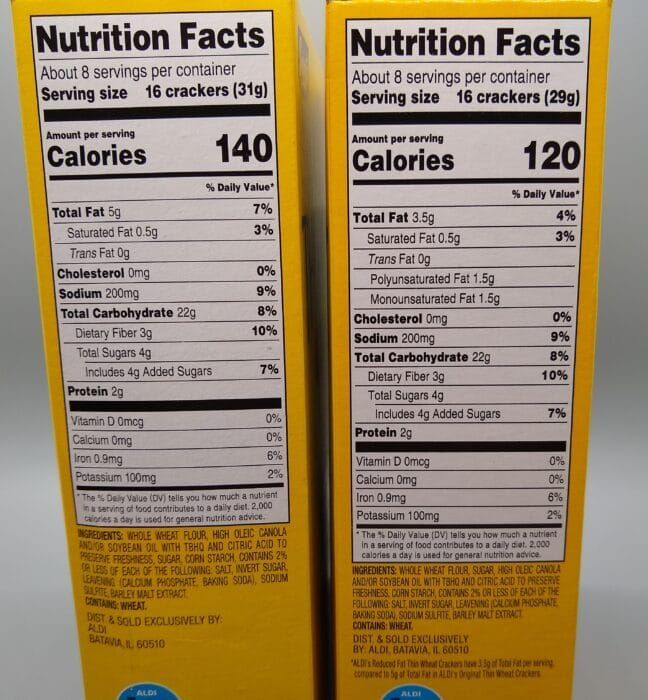
The image size is (648, 700). Find the location of `box`. box is located at coordinates (286, 630).